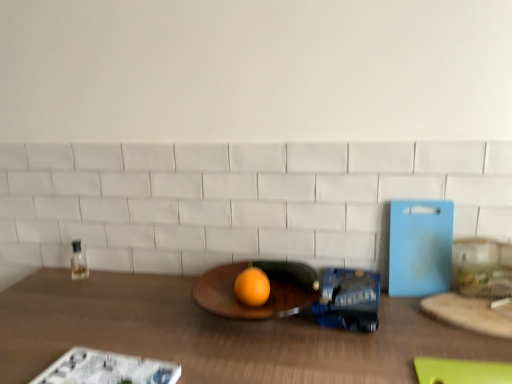
I want to click on free space in front of clear glass bottle at left, so click(x=67, y=304).